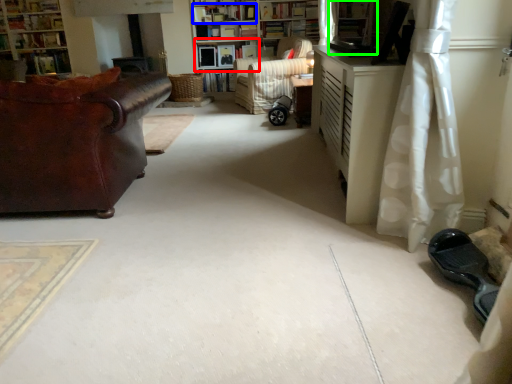
Question: Based on their relative distances, which object is nearer to shelf (highlighted by a red box)? Choose from book (highlighted by a blue box) and shelf (highlighted by a green box).

Choices:
 (A) book
 (B) shelf

Answer: (A)